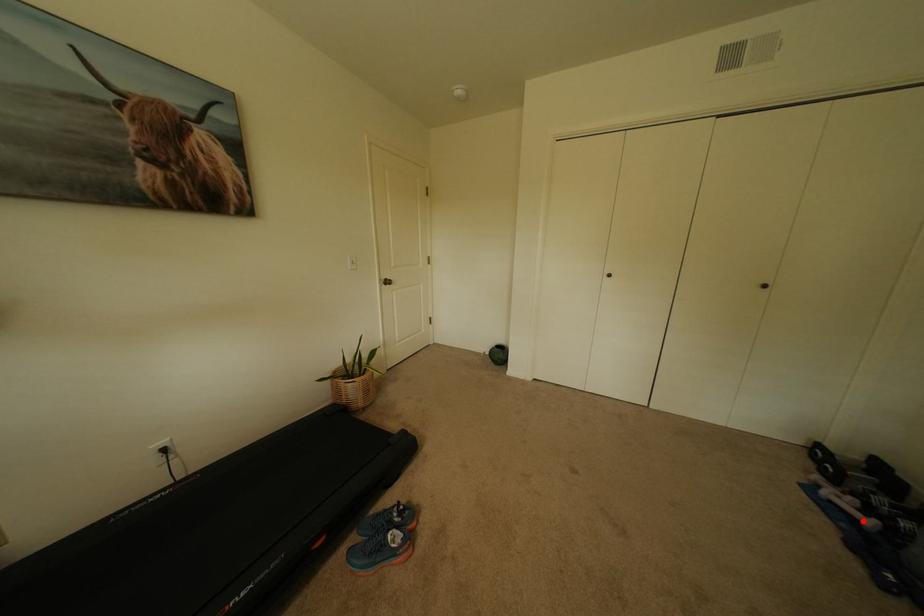
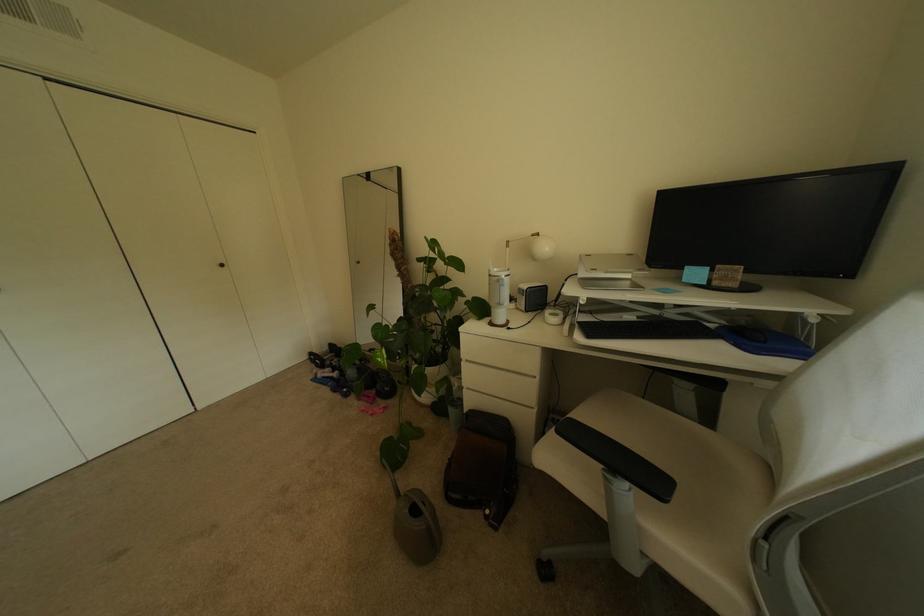
Where in the second image is the point corresponding to the highlighted location from the first image?

(341, 379)